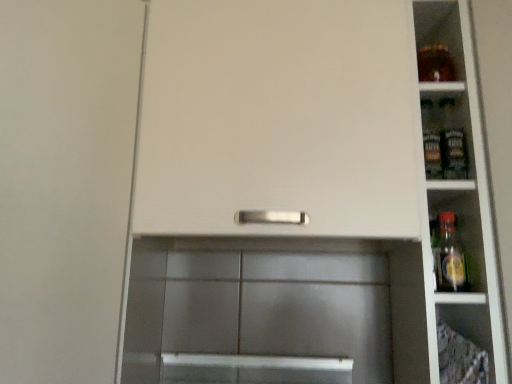
Question: From the image's perspective, is white matte cabinet door at center positioned above or below white glossy shelves at right?

Choices:
 (A) above
 (B) below

Answer: (B)

Question: Do you think white matte cabinet door at center is within white glossy shelves at right, or outside of it?

Choices:
 (A) outside
 (B) inside

Answer: (A)

Question: Is point (123, 91) positioned closer to the camera than point (489, 349)?

Choices:
 (A) closer
 (B) farther

Answer: (B)

Question: Is white glossy shelves at right to the left or to the right of white matte cabinet door at center in the image?

Choices:
 (A) right
 (B) left

Answer: (A)

Question: Does point (473, 208) appear closer or farther from the camera than point (47, 238)?

Choices:
 (A) closer
 (B) farther

Answer: (B)

Question: Which is correct: white glossy shelves at right is inside white matte cabinet door at center, or outside of it?

Choices:
 (A) inside
 (B) outside

Answer: (B)

Question: Considering their positions, is white glossy shelves at right located in front of or behind white matte cabinet door at center?

Choices:
 (A) front
 (B) behind

Answer: (B)